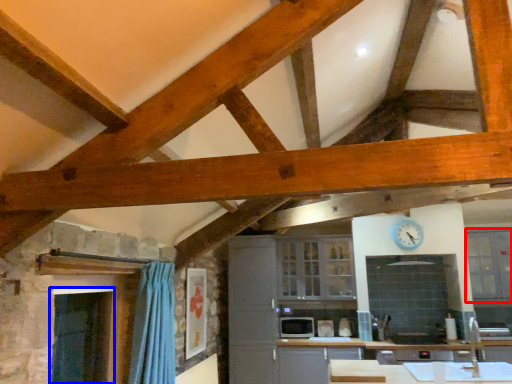
Question: Which object appears farthest to the camera in this image, window (highlighted by a red box) or window screen (highlighted by a blue box)?

Choices:
 (A) window
 (B) window screen

Answer: (A)